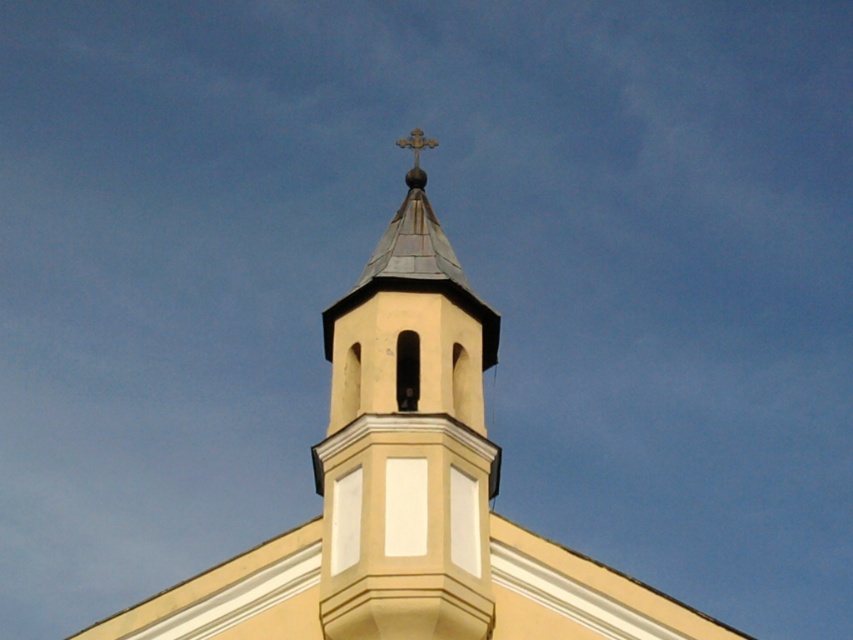
Question: Which point appears closest to the camera in this image?

Choices:
 (A) (426, 220)
 (B) (431, 141)

Answer: (A)

Question: Does smooth beige steeple at center appear under gold metallic cross at upper center?

Choices:
 (A) yes
 (B) no

Answer: (A)

Question: Which object appears farthest from the camera in this image?

Choices:
 (A) smooth beige steeple at center
 (B) gold metallic cross at upper center

Answer: (B)

Question: Considering the relative positions of smooth beige steeple at center and gold metallic cross at upper center in the image provided, where is smooth beige steeple at center located with respect to gold metallic cross at upper center?

Choices:
 (A) left
 (B) right

Answer: (B)

Question: Does smooth beige steeple at center appear over gold metallic cross at upper center?

Choices:
 (A) yes
 (B) no

Answer: (B)